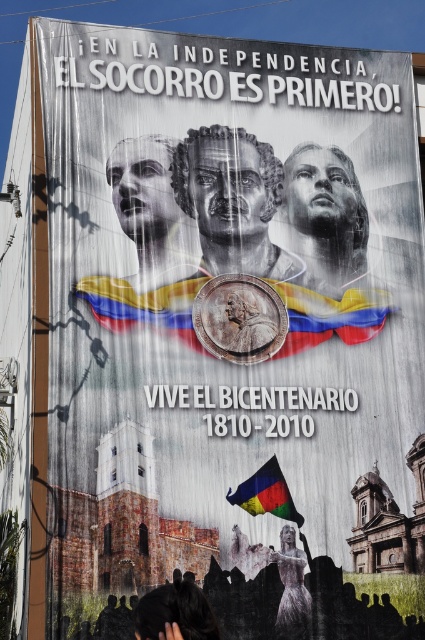
Question: Observing the image, what is the correct spatial positioning of silvery metallic dress at center in reference to multicolored fabric flag at center?

Choices:
 (A) above
 (B) below

Answer: (B)

Question: Can you confirm if grayscale sculpture at center is positioned below silvery metallic dress at center?

Choices:
 (A) yes
 (B) no

Answer: (B)

Question: Which point is farther to the camera?

Choices:
 (A) black hair at lower left
 (B) silvery metallic dress at center

Answer: (B)

Question: Is grayscale sculpture at center thinner than black hair at lower left?

Choices:
 (A) no
 (B) yes

Answer: (A)

Question: Which object is positioned closest to the polished metallic coin at center?

Choices:
 (A) silvery metallic dress at center
 (B) multicolored fabric flag at center

Answer: (B)

Question: Which of the following is the closest to the observer?

Choices:
 (A) polished metallic coin at center
 (B) multicolored fabric flag at center
 (C) grayscale sculpture at center
 (D) black hair at lower left

Answer: (D)